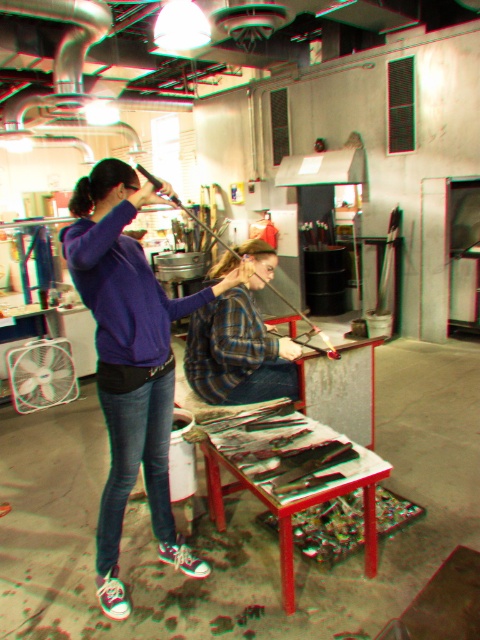
Question: Which point is closer to the camera?

Choices:
 (A) denim jeans at center
 (B) plaid fabric shirt at center

Answer: (A)

Question: Does purple matte hoodie at upper left lie behind wooden table at center?

Choices:
 (A) no
 (B) yes

Answer: (A)

Question: Does denim jeans at center appear on the right side of denim at center?

Choices:
 (A) no
 (B) yes

Answer: (A)

Question: Can you confirm if plaid fabric shirt at center is positioned to the right of denim at center?

Choices:
 (A) yes
 (B) no

Answer: (B)

Question: Which point is closer to the camera taking this photo?

Choices:
 (A) (126, 477)
 (B) (263, 376)
 (C) (282, 342)

Answer: (A)

Question: Which object appears closest to the camera in this image?

Choices:
 (A) denim at center
 (B) plaid fabric shirt at center
 (C) purple matte hoodie at upper left

Answer: (C)